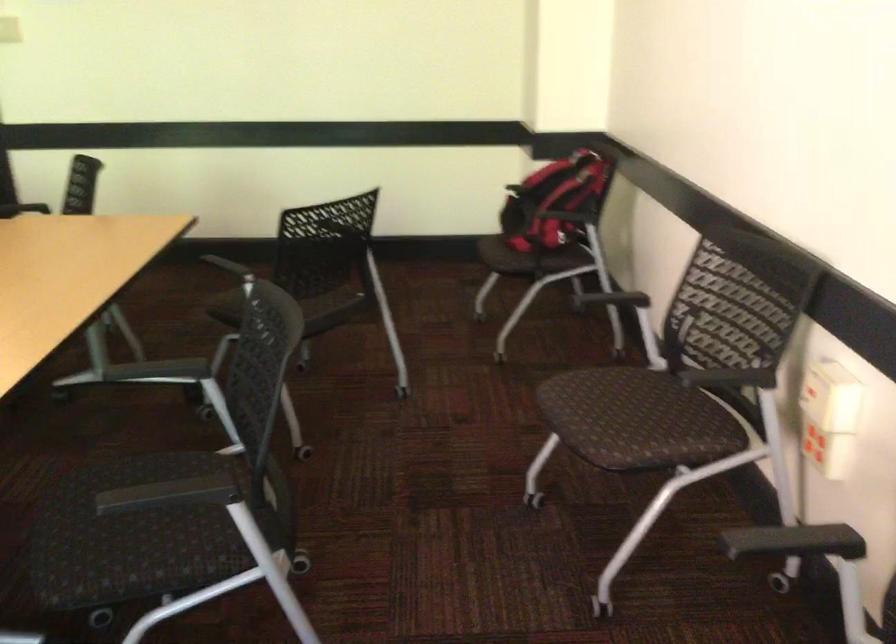
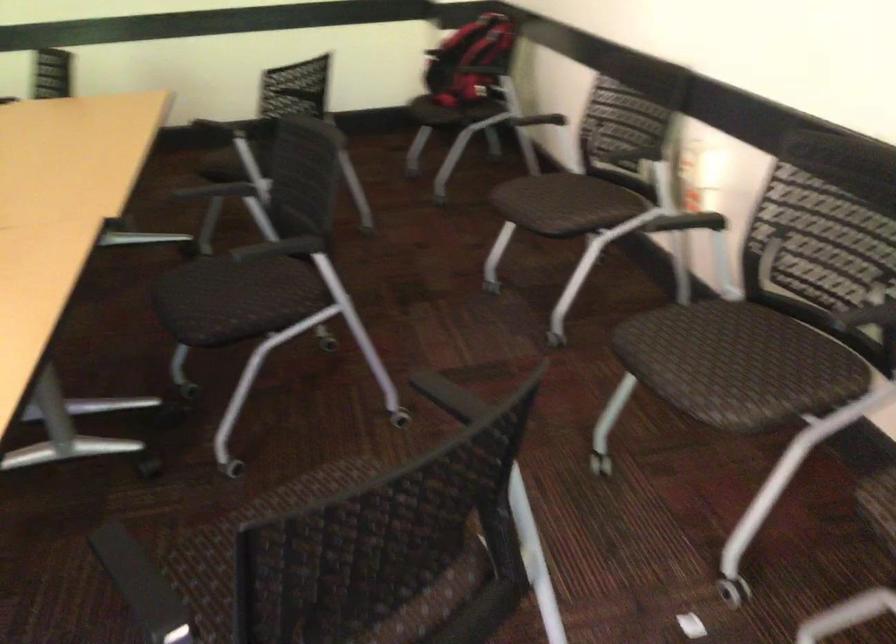
The point at (125, 541) is marked in the first image. Where is the corresponding point in the second image?

(222, 301)